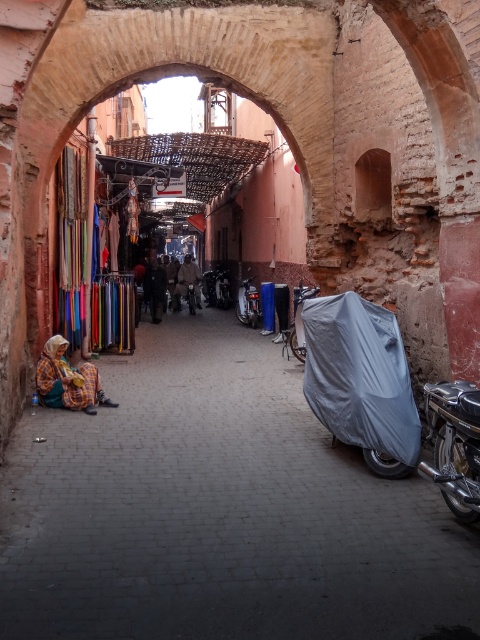
Question: Can you confirm if shiny chrome motorcycle at right is wider than brown leather jacket at center?

Choices:
 (A) yes
 (B) no

Answer: (B)

Question: Estimate the real-world distances between objects in this image. Which object is closer to the gray matte tarp at center-right?

Choices:
 (A) shiny chrome motorcycle at center
 (B) shiny chrome motorcycle at right

Answer: (B)

Question: Which point is farther to the camera?

Choices:
 (A) (356, 294)
 (B) (38, 388)

Answer: (B)

Question: Is gray matte tarp at center-right closer to the viewer compared to yellow plaid fabric at lower left?

Choices:
 (A) no
 (B) yes

Answer: (B)

Question: Which point is closer to the camera?

Choices:
 (A) (455, 426)
 (B) (183, 259)

Answer: (A)

Question: Does gray matte tarp at center-right come behind brown leather jacket at center?

Choices:
 (A) yes
 (B) no

Answer: (B)